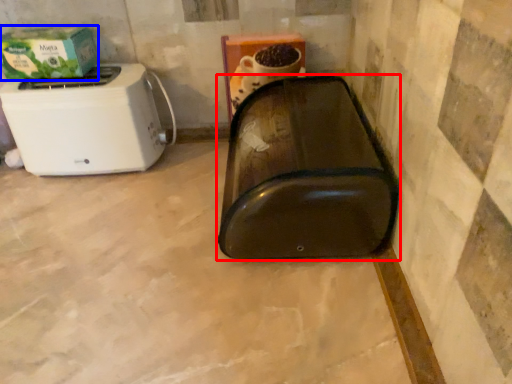
Question: Which of the following is the farthest to the observer, appliance (highlighted by a red box) or box (highlighted by a blue box)?

Choices:
 (A) appliance
 (B) box

Answer: (B)